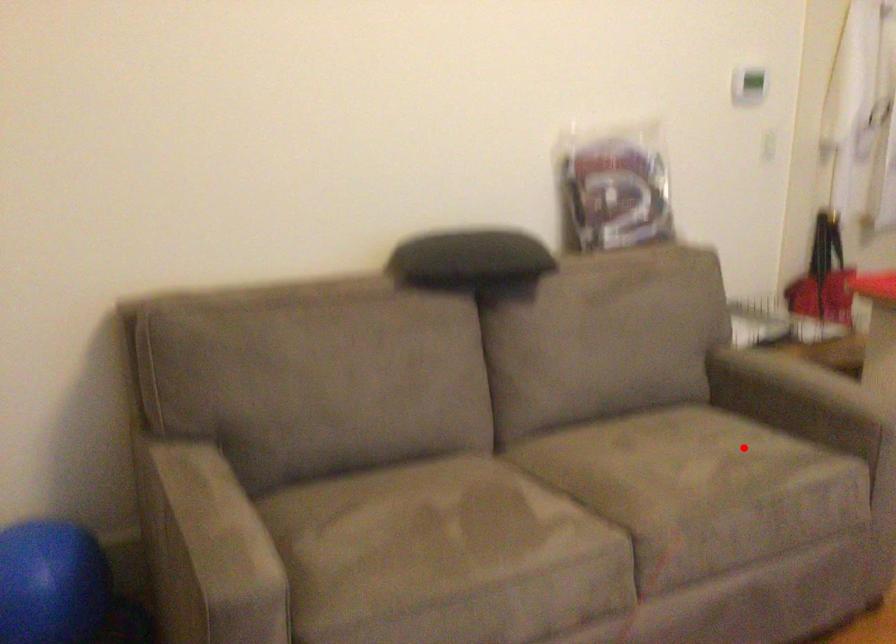
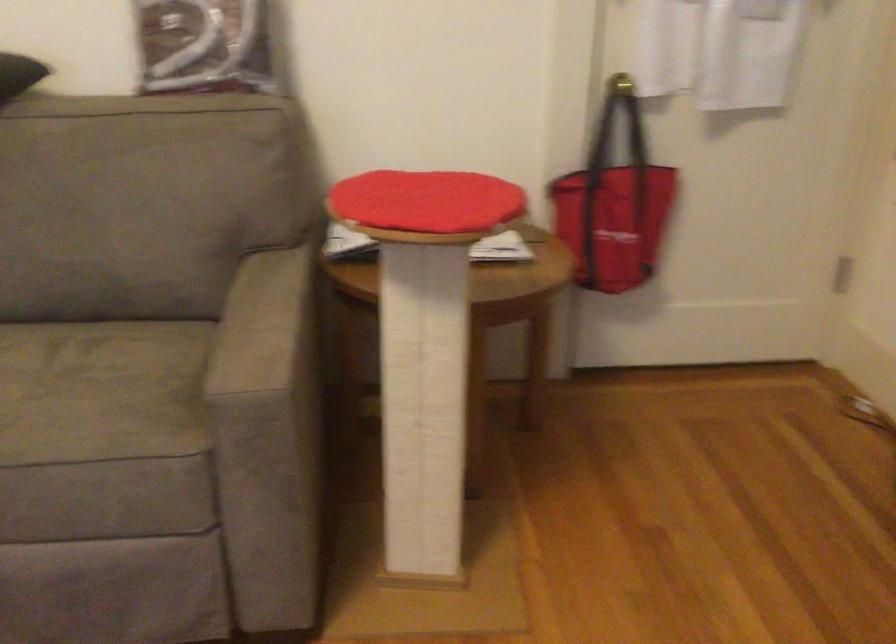
Locate, in the second image, the point that corresponds to the highlighted location in the first image.

(101, 391)